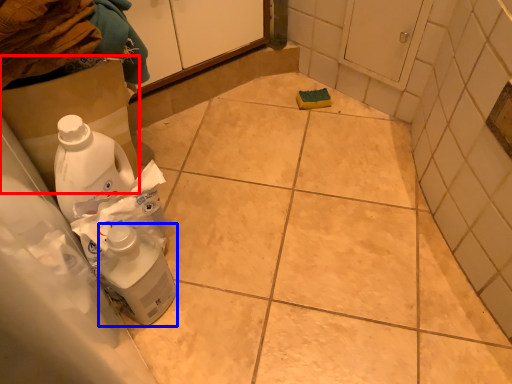
Question: Which of the following is the farthest to the observer, cardboard box (highlighted by a red box) or cleaning product (highlighted by a blue box)?

Choices:
 (A) cardboard box
 (B) cleaning product

Answer: (A)